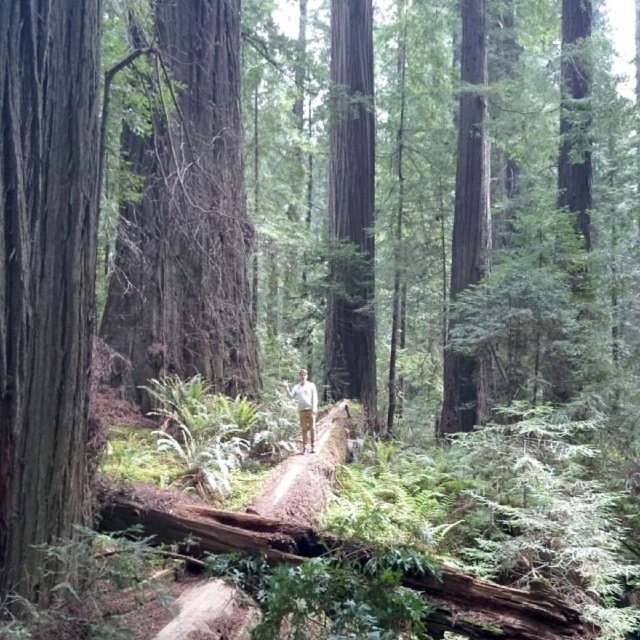
You are a hiker who wants to take a photo of the smooth brown tree trunk at left and the white cotton shirt at center. Which object is wider in the image?

The smooth brown tree trunk at left is wider than the white cotton shirt at center.

Looking at this image, you are a hiker wearing a white cotton shirt at center and standing on a brown dirt trail at center in a forest. You want to place a small backpack on the ground next to you. Which object should you place it next to to ensure it stays visible and not buried by the terrain?

You should place the backpack next to the white cotton shirt at center because the brown dirt trail at center has a lesser height and might bury the backpack.

You are hiking in the forest and want to find the brown dirt trail at center. According to the map, you are currently at point [305,472]. Is the trail directly in front of you?

Yes, the brown dirt trail at center is marked by point [305,472], so it is directly in front of you.